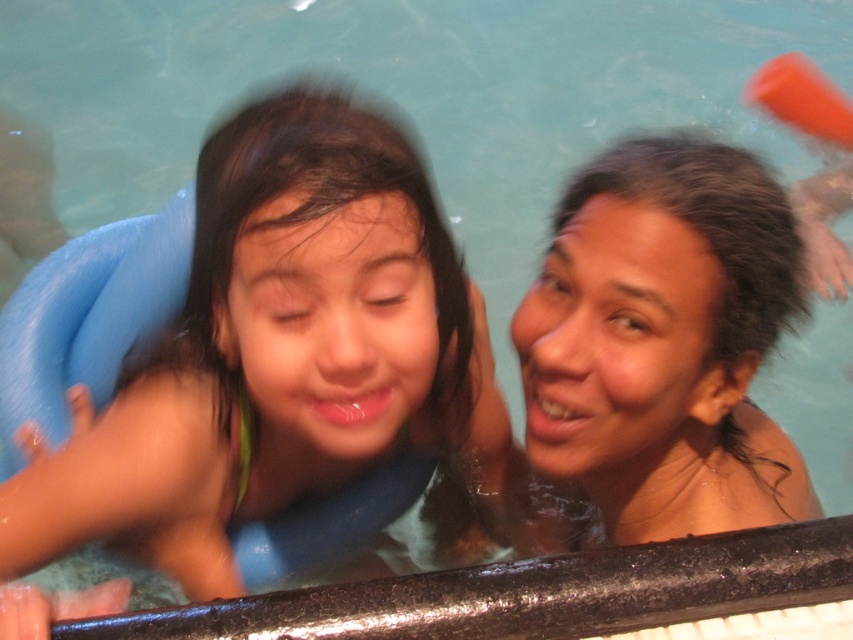
Can you confirm if smooth blue float at left is thinner than smooth skin woman at upper right?

No, smooth blue float at left is not thinner than smooth skin woman at upper right.

Which of these two, smooth blue float at left or smooth skin woman at upper right, stands taller?

Standing taller between the two is smooth blue float at left.

Who is more forward, (263,125) or (616,499)?

Point (263,125)

Image resolution: width=853 pixels, height=640 pixels. In order to click on smooth blue float at left in this screenshot , I will do `click(263, 362)`.